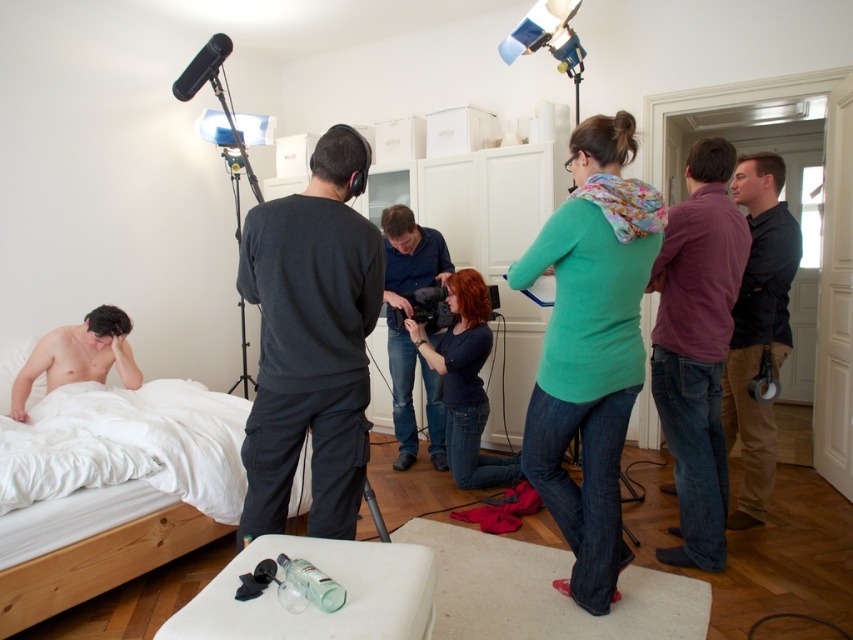
Question: Which object is the closest to the metallic silver tripod at center-right?

Choices:
 (A) dark purple shirt at center
 (B) dark blue sweater at center
 (C) green matte shirt at center

Answer: (A)

Question: Where is dark purple shirt at center located in relation to dark blue sweater at center in the image?

Choices:
 (A) above
 (B) below

Answer: (A)

Question: Among these objects, which one is nearest to the camera?

Choices:
 (A) dark blue sweater at center
 (B) blue jeans at center
 (C) white wood bed at lower left
 (D) metallic silver tripod at center-right

Answer: (C)

Question: In this image, where is dark gray sweater at center located relative to blue jeans at center?

Choices:
 (A) below
 (B) above

Answer: (A)

Question: Among these points, which one is farthest from the camera?

Choices:
 (A) (132, 378)
 (B) (448, 372)

Answer: (B)

Question: Is dark purple shirt at center to the right of smooth skin man at lower left from the viewer's perspective?

Choices:
 (A) yes
 (B) no

Answer: (A)